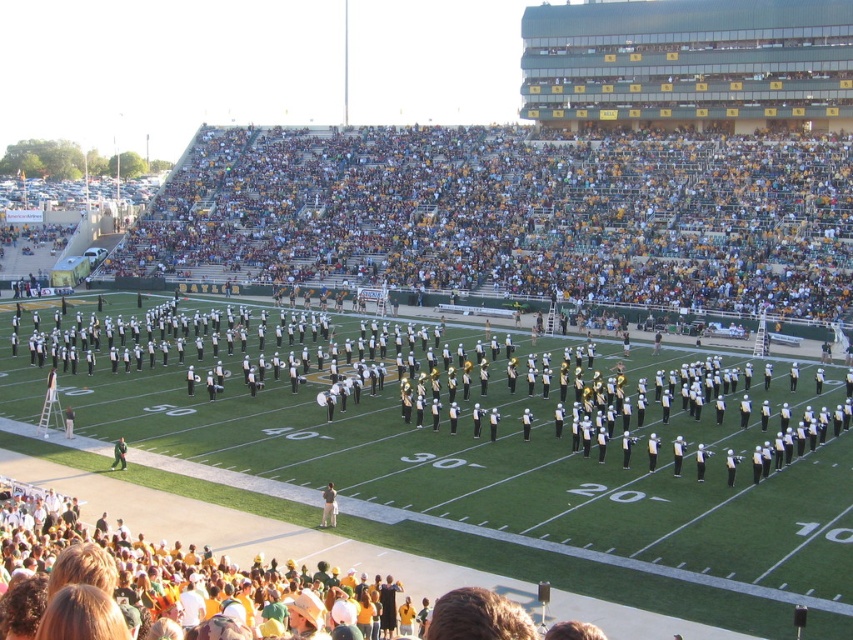
Is the position of white cotton shirt at lower center more distant than that of green uniformed person at lower left?

No, it is not.

The height and width of the screenshot is (640, 853). Describe the element at coordinates (328, 506) in the screenshot. I see `white cotton shirt at lower center` at that location.

Where is `white cotton shirt at lower center`? The height and width of the screenshot is (640, 853). white cotton shirt at lower center is located at coordinates (328, 506).